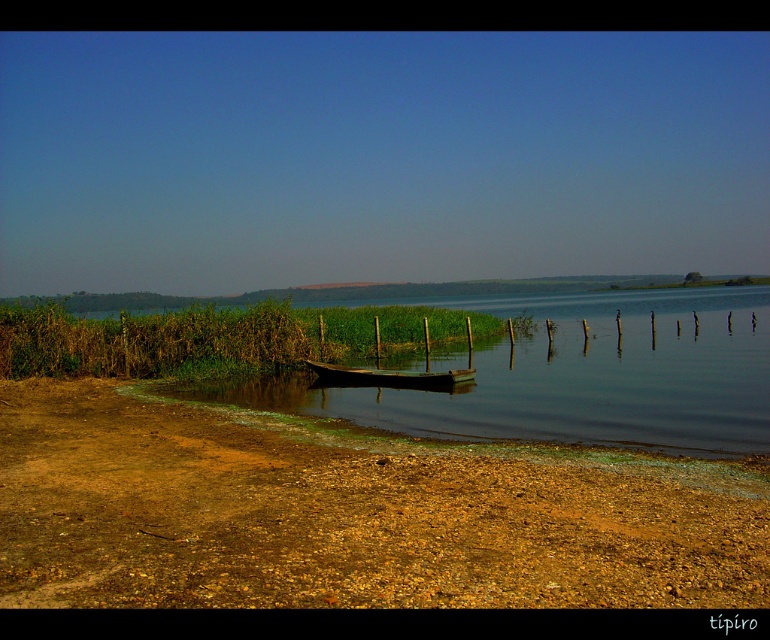
Does point (623, 477) lie in front of point (397, 371)?

Yes, it is in front of point (397, 371).

Is brown gravel shore at lower left positioned at the back of wooden boat at center?

No.

Does point (755, 596) lie in front of point (454, 378)?

Yes, it is.

Identify the location of brown gravel shore at lower left. The image size is (770, 640). (350, 513).